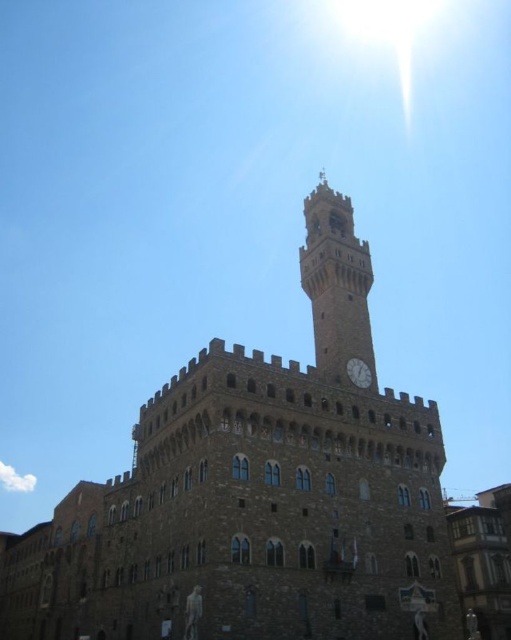
Question: Which point is closer to the camera?

Choices:
 (A) brown stone castle at center
 (B) white glossy clock at center
 (C) stone clock tower at center

Answer: (A)

Question: Is the position of brown stone castle at center less distant than that of white glossy clock at center?

Choices:
 (A) no
 (B) yes

Answer: (B)

Question: Estimate the real-world distances between objects in this image. Which object is closer to the stone clock tower at center?

Choices:
 (A) white glossy clock at center
 (B) brown stone castle at center

Answer: (B)

Question: Which is farther from the brown stone castle at center?

Choices:
 (A) stone clock tower at center
 (B) white glossy clock at center

Answer: (B)

Question: Does brown stone castle at center have a greater width compared to stone clock tower at center?

Choices:
 (A) no
 (B) yes

Answer: (B)

Question: Is brown stone castle at center positioned before stone clock tower at center?

Choices:
 (A) yes
 (B) no

Answer: (A)